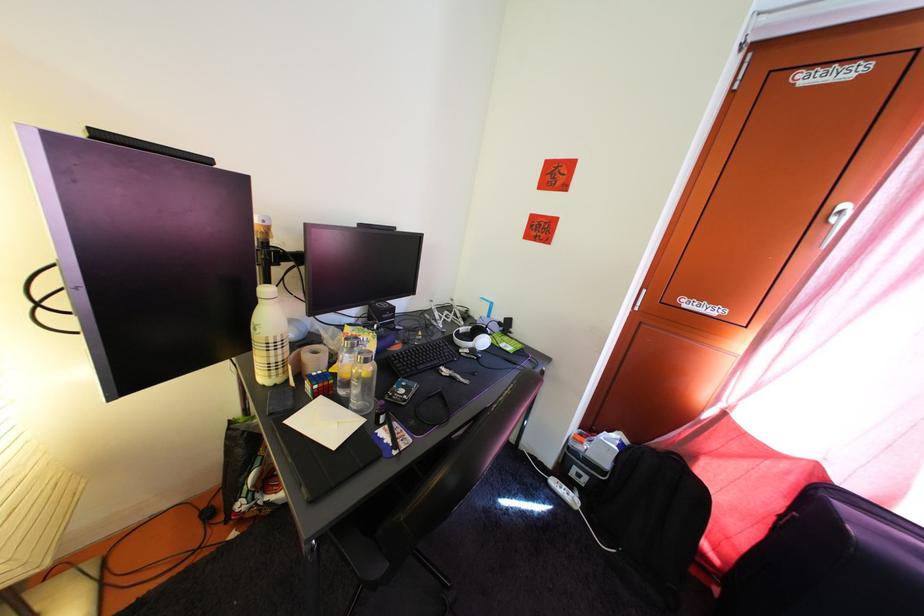
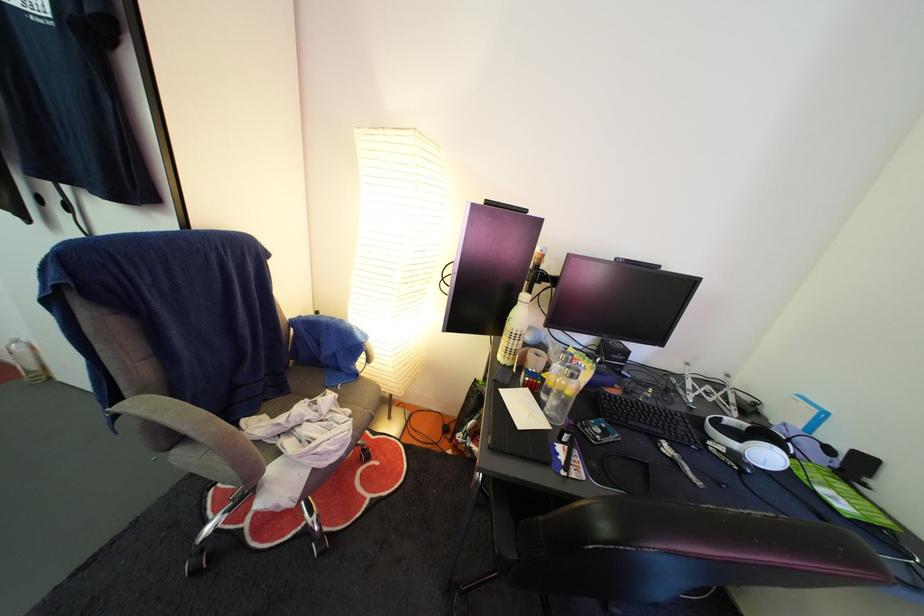
In the second image, find the point that corresponds to the point at 369,362 in the first image.

(578, 376)